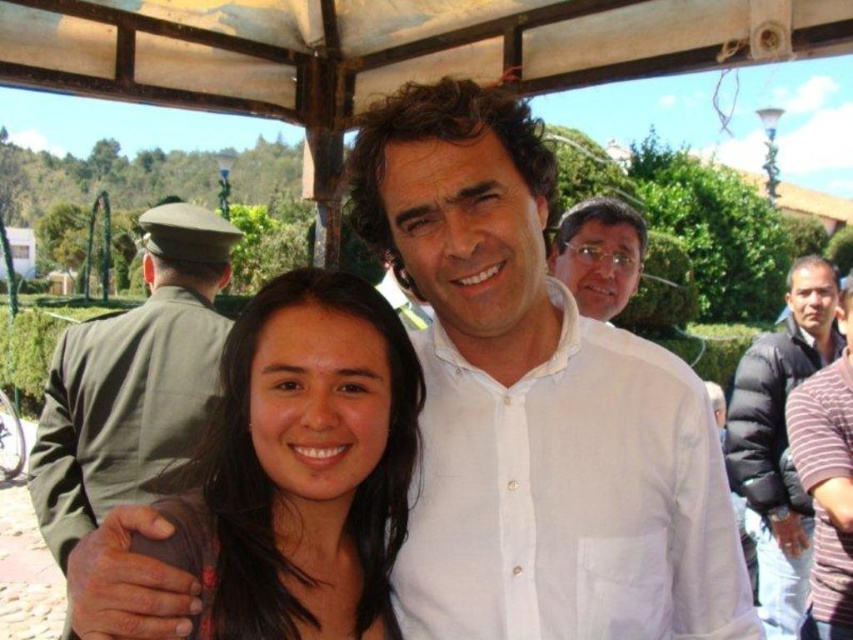
Question: Which point is closer to the camera?

Choices:
 (A) black puffy jacket at right
 (B) brown hair at center
 (C) white linen shirt at center
 (D) green uniform at left

Answer: (D)

Question: Is white linen shirt at center to the left of black puffy jacket at right from the viewer's perspective?

Choices:
 (A) yes
 (B) no

Answer: (A)

Question: Which object appears farthest from the camera in this image?

Choices:
 (A) matte white shirt at upper center
 (B) green uniform at left

Answer: (A)

Question: Which object appears farthest from the camera in this image?

Choices:
 (A) white linen shirt at center
 (B) brown hair at center
 (C) green uniform at left

Answer: (A)

Question: Where is white linen shirt at center located in relation to green uniform at left in the image?

Choices:
 (A) below
 (B) above

Answer: (B)

Question: Does white linen shirt at center lie in front of matte white shirt at upper center?

Choices:
 (A) yes
 (B) no

Answer: (A)